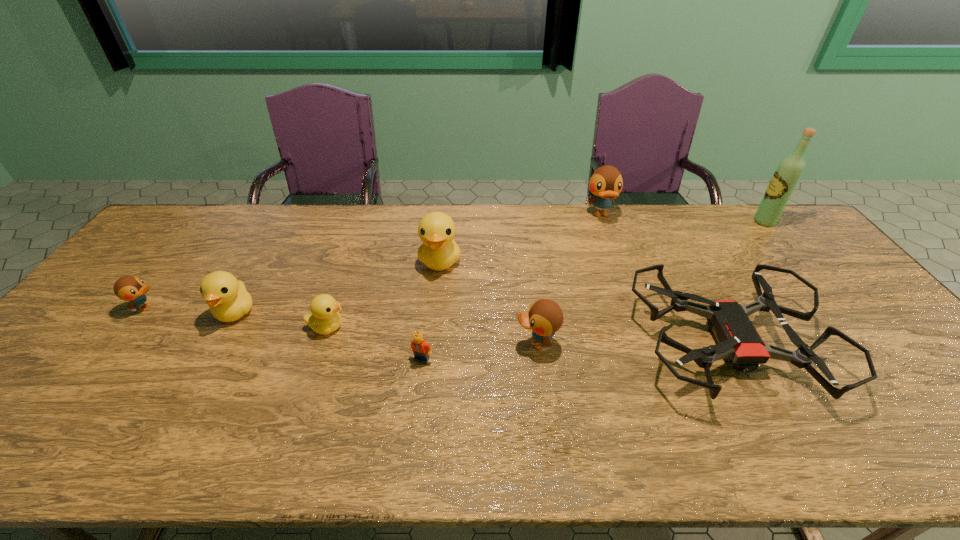
Identify which duck is the third nearest to the tallest object. Please provide its 2D coordinates. Your answer should be formatted as a tuple, i.e. [(x, y)], where the tuple contains the x and y coordinates of a point satisfying the conditions above.

[(439, 251)]

Locate an element on the screen. The width and height of the screenshot is (960, 540). duck identified as the fourth closest to the rightmost object is located at coordinates (325, 318).

Choose which blue duck is the nearest neighbor to the leftmost yellow duck. Please provide its 2D coordinates. Your answer should be formatted as a tuple, i.e. [(x, y)], where the tuple contains the x and y coordinates of a point satisfying the conditions above.

[(128, 288)]

Select which blue duck appears as the third closest to the fourth duck from right to left. Please provide its 2D coordinates. Your answer should be formatted as a tuple, i.e. [(x, y)], where the tuple contains the x and y coordinates of a point satisfying the conditions above.

[(606, 183)]

Identify which yellow duck is located as the second nearest to the smallest yellow duck. Please provide its 2D coordinates. Your answer should be formatted as a tuple, i.e. [(x, y)], where the tuple contains the x and y coordinates of a point satisfying the conditions above.

[(439, 251)]

Locate which yellow duck ranks third in proximity to the drone. Please provide its 2D coordinates. Your answer should be formatted as a tuple, i.e. [(x, y)], where the tuple contains the x and y coordinates of a point satisfying the conditions above.

[(228, 300)]

Where is `free space that satisfies the following two spatial constraints: 1. on the front-facing side of the white wine bottle; 2. on the front-facing side of the Lego`? This screenshot has width=960, height=540. free space that satisfies the following two spatial constraints: 1. on the front-facing side of the white wine bottle; 2. on the front-facing side of the Lego is located at coordinates (878, 359).